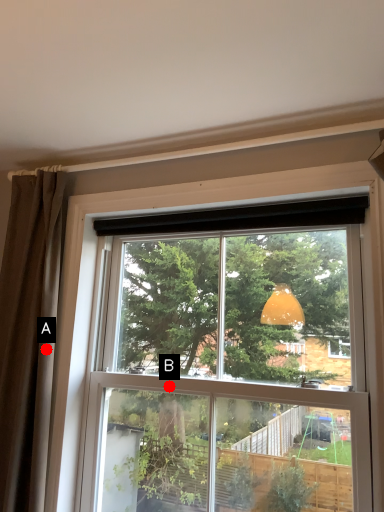
Question: Two points are circled on the image, labeled by A and B beside each circle. Which point is farther from the camera taking this photo?

Choices:
 (A) A is further
 (B) B is further

Answer: (B)